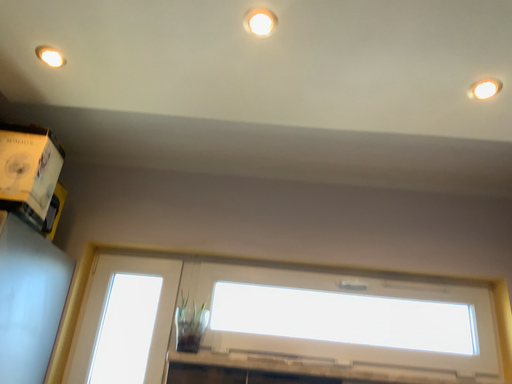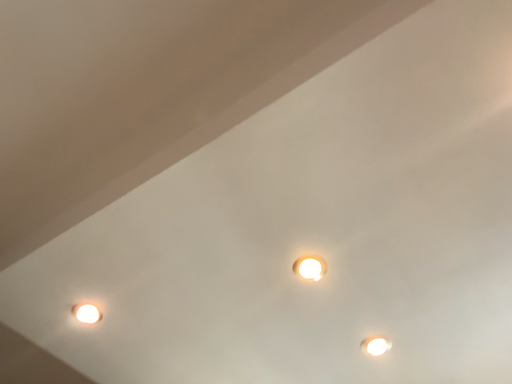
Question: Which way did the camera rotate in the video?

Choices:
 (A) rotated downward
 (B) rotated upward

Answer: (B)